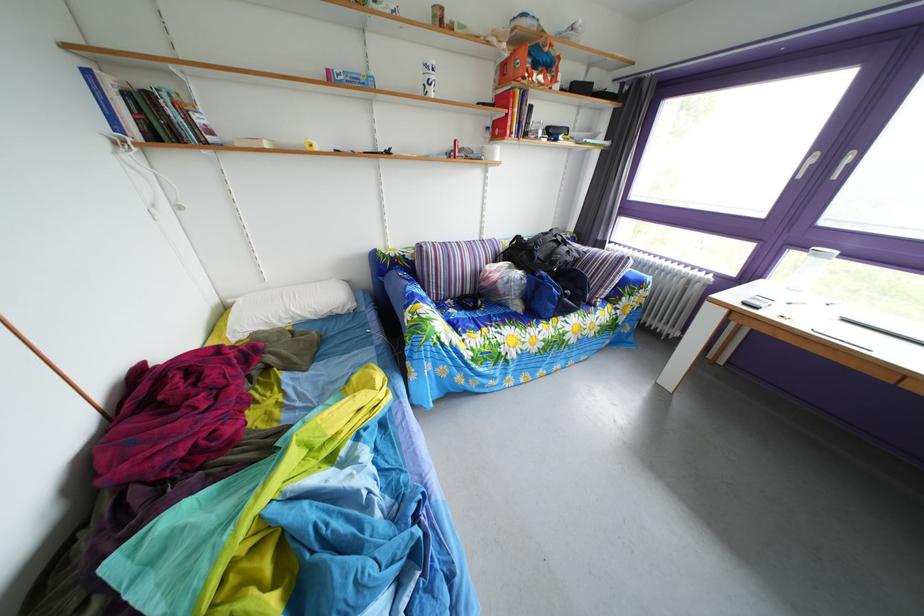
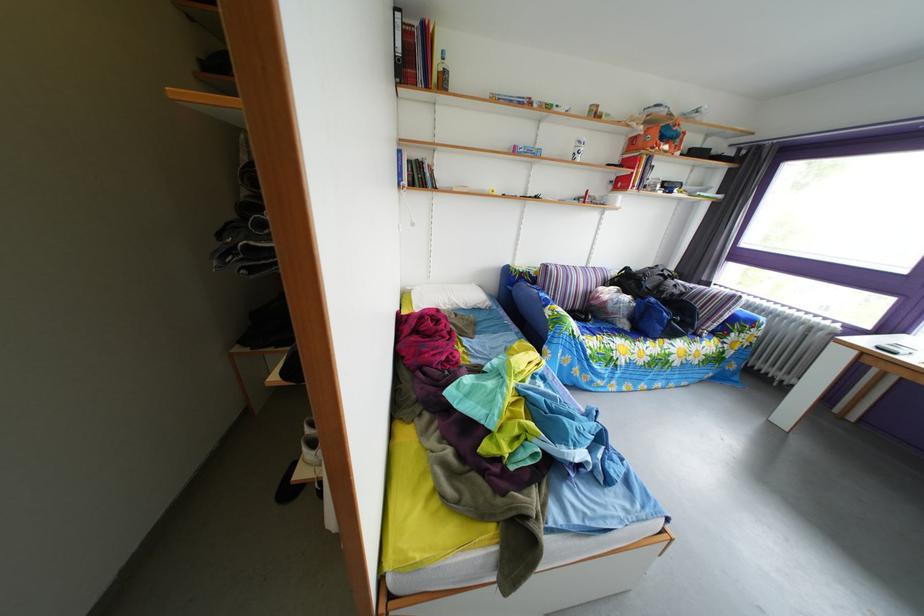
The point at (529,261) is marked in the first image. Where is the corresponding point in the second image?

(638, 289)